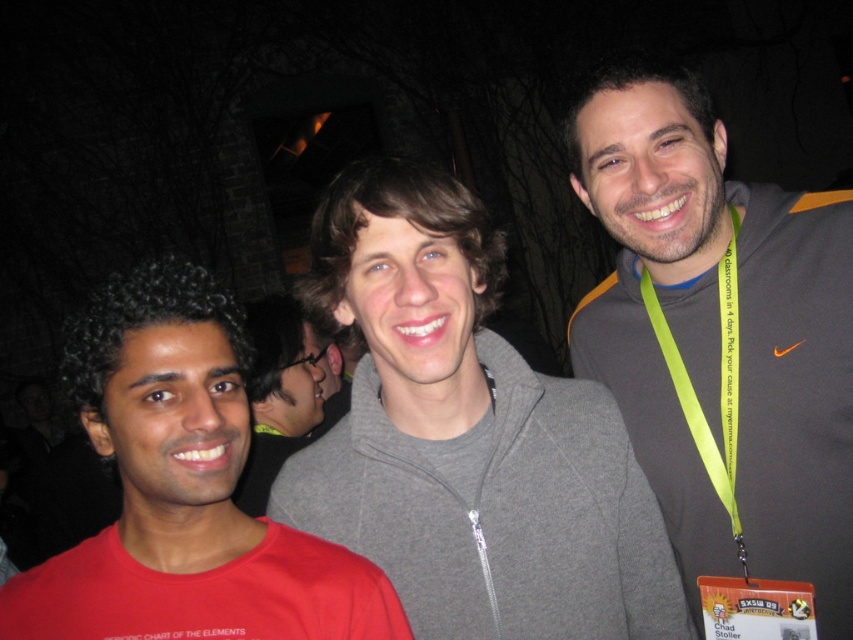
Locate an element on the screen. matte gray hoodie at center is located at coordinates (183, 490).

Can you confirm if matte gray hoodie at center is taller than gray fabric neck at center?

Yes.

In order to click on matte gray hoodie at center in this screenshot , I will do `click(183, 490)`.

Between matte gray hoodie at center and green fabric lanyard at right, which one has less height?

Standing shorter between the two is matte gray hoodie at center.

Who is positioned more to the left, matte gray hoodie at center or green fabric lanyard at right?

matte gray hoodie at center

Is point (206, 420) positioned after point (648, 289)?

No, (206, 420) is closer to viewer.

Locate an element on the screen. matte gray hoodie at center is located at coordinates (183, 490).

Who is positioned more to the left, matte gray hoodie at center or matte red neck at center?

From the viewer's perspective, matte gray hoodie at center appears more on the left side.

Between matte gray hoodie at center and matte red neck at center, which one is positioned lower?

Positioned lower is matte gray hoodie at center.

Find the location of a particular element. The image size is (853, 640). matte gray hoodie at center is located at coordinates (183, 490).

The height and width of the screenshot is (640, 853). Identify the location of matte gray hoodie at center. (183, 490).